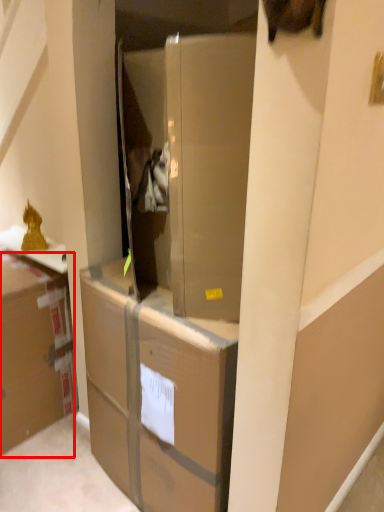
Question: Where is cardboard box (annotated by the red box) located in relation to cabinetry in the image?

Choices:
 (A) right
 (B) left

Answer: (B)